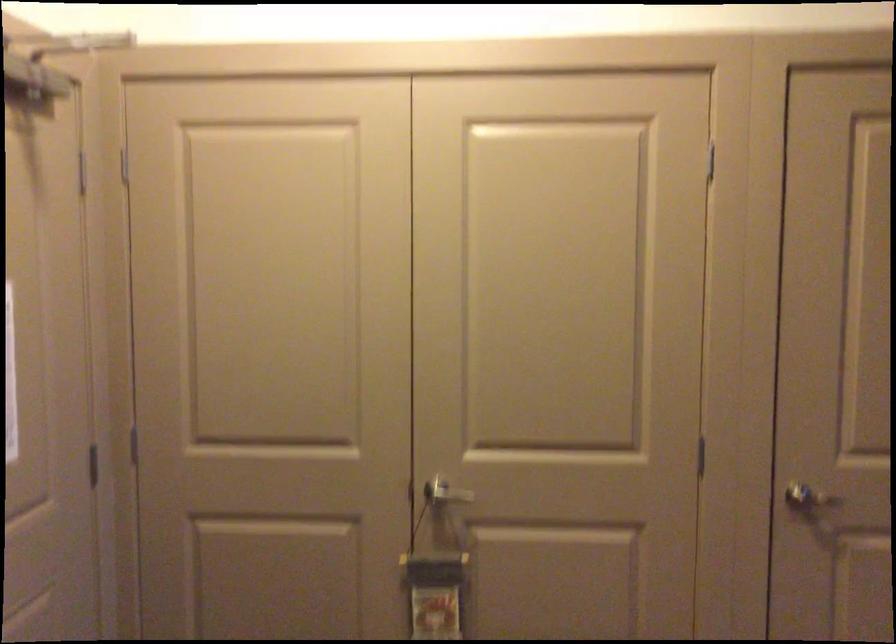
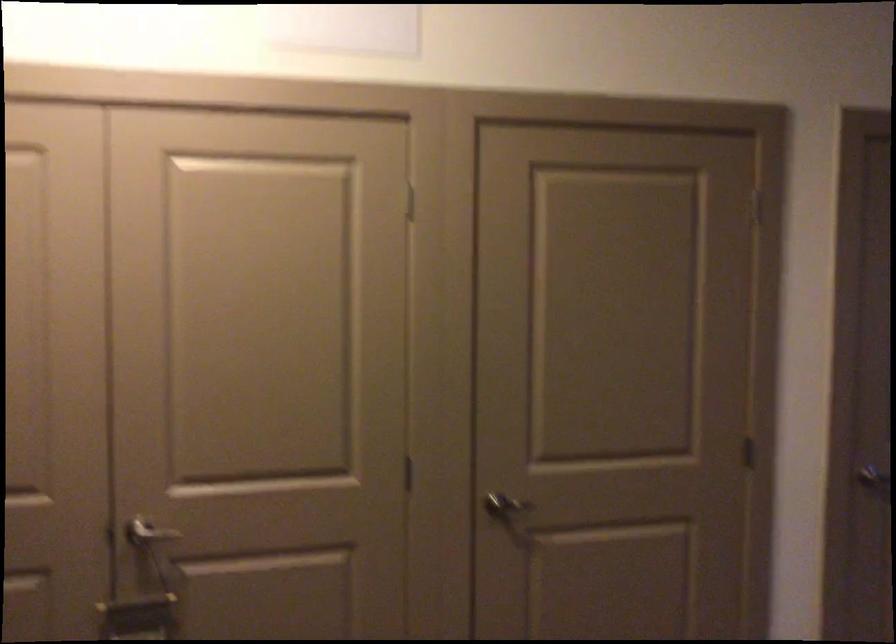
Question: The first image is from the beginning of the video and the second image is from the end. How did the camera likely rotate when shooting the video?

Choices:
 (A) Left
 (B) Right
 (C) Up
 (D) Down

Answer: (B)